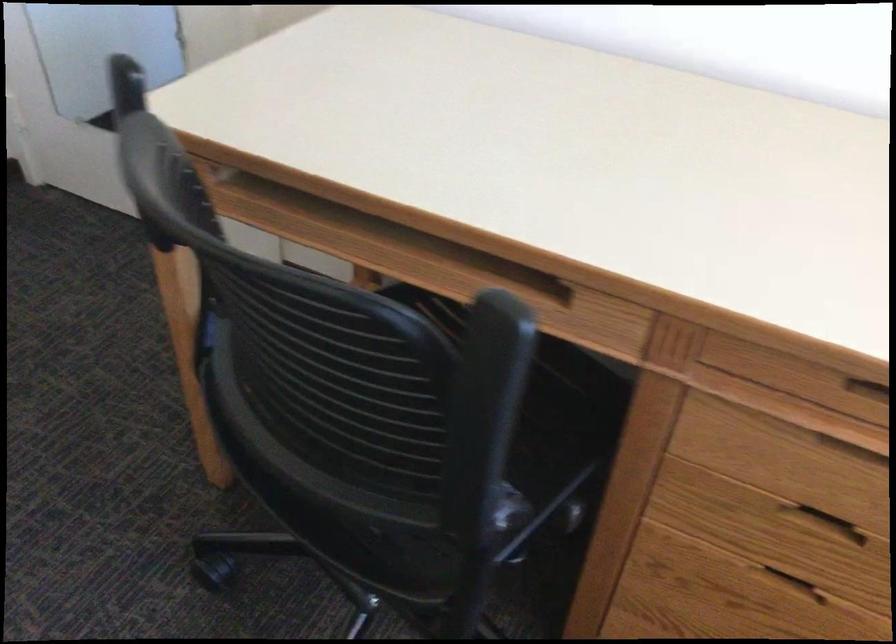
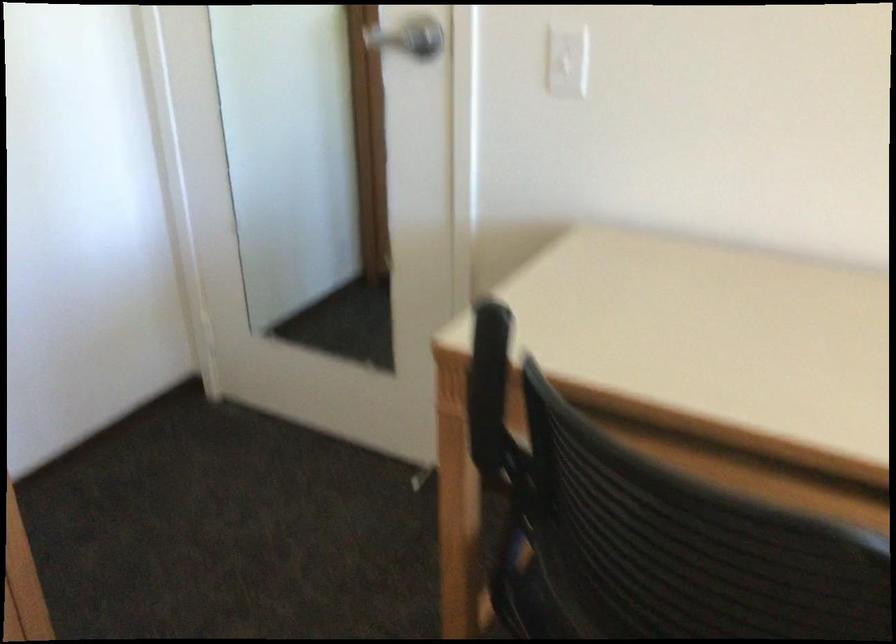
Question: Based on the continuous images, in which direction is the camera rotating? Reply with the corresponding letter.

Choices:
 (A) Left
 (B) Right
 (C) Up
 (D) Down

Answer: (C)